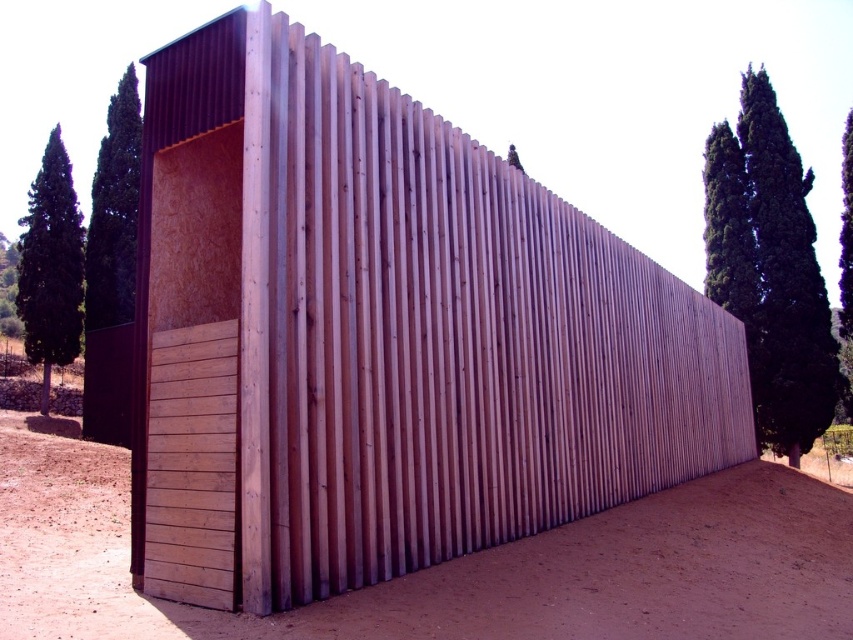
You are standing at the point labeled point (x=695, y=541). You want to walk directly towards the nearest tree. How far will you have to walk?

The nearest tree is 8.00 meters away from the point labeled point (x=695, y=541), so you will have to walk 8.00 meters.

You are a landscape architect designing a garden around the modern structure. You have to place a 3m wide decorative stone path between the brown sandy dirt at lower center and the green leafy cypress at upper right. Can the path fit between them without overlapping either object?

The brown sandy dirt at lower center is wider than the green leafy cypress at upper right. Since the path requires 3 meters of width, the brown sandy dirt at lower center has sufficient width to accommodate the path without overlapping either object.